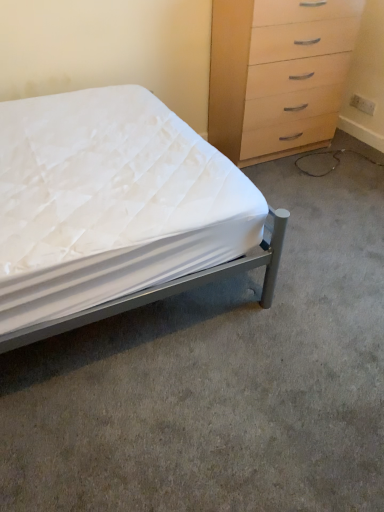
What is the approximate width of white fabric bed at lower left?

white fabric bed at lower left is 2.35 meters in width.

I want to click on metallic gray bed at left, so click(x=116, y=211).

Identify the location of light wood/wooden chest of drawers at upper right. (278, 74).

Which object is closer to the camera taking this photo, metallic gray bed at left or light wood/wooden chest of drawers at upper right?

Positioned in front is metallic gray bed at left.

Are metallic gray bed at left and light wood/wooden chest of drawers at upper right beside each other?

No, metallic gray bed at left is not beside light wood/wooden chest of drawers at upper right.

Is metallic gray bed at left positioned with its back to light wood/wooden chest of drawers at upper right?

metallic gray bed at left is not turned away from light wood/wooden chest of drawers at upper right.

Considering the sizes of objects light wood/wooden chest of drawers at upper right and white fabric bed at lower left in the image provided, who is bigger, light wood/wooden chest of drawers at upper right or white fabric bed at lower left?

light wood/wooden chest of drawers at upper right is bigger.

From the picture: From a real-world perspective, is light wood/wooden chest of drawers at upper right positioned under white fabric bed at lower left based on gravity?

Incorrect, from a real-world perspective, light wood/wooden chest of drawers at upper right is higher than white fabric bed at lower left.

Considering the sizes of light wood/wooden chest of drawers at upper right and white fabric bed at lower left in the image, is light wood/wooden chest of drawers at upper right wider or thinner than white fabric bed at lower left?

Considering their sizes, light wood/wooden chest of drawers at upper right looks slimmer than white fabric bed at lower left.

From the image's perspective, is light wood/wooden chest of drawers at upper right under white fabric bed at lower left?

No, from the image's perspective, light wood/wooden chest of drawers at upper right is not below white fabric bed at lower left.

Is light wood/wooden chest of drawers at upper right positioned far away from metallic gray bed at left?

Absolutely, light wood/wooden chest of drawers at upper right is distant from metallic gray bed at left.

Consider the image. Between light wood/wooden chest of drawers at upper right and metallic gray bed at left, which one has larger size?

metallic gray bed at left.

You are a GUI agent. You are given a task and a screenshot of the screen. Output one action in this format:
    pyautogui.click(x=<x>, y=<y>)
    Task: Click on the bed below the light wood/wooden chest of drawers at upper right (from a real-world perspective)
    The image size is (384, 512).
    Given the screenshot: What is the action you would take?
    (x=116, y=211)

Is white fabric bed at lower left thinner than metallic gray bed at left?

Incorrect, the width of white fabric bed at lower left is not less than that of metallic gray bed at left.

Is metallic gray bed at left a part of white fabric bed at lower left?

Definitely not — metallic gray bed at left is not inside white fabric bed at lower left.

From a real-world perspective, which is physically below, white fabric bed at lower left or metallic gray bed at left?

white fabric bed at lower left is physically lower.

Considering the positions of objects white fabric bed at lower left and metallic gray bed at left in the image provided, who is more to the left, white fabric bed at lower left or metallic gray bed at left?

Positioned to the left is metallic gray bed at left.

Does white fabric bed at lower left have a larger size compared to light wood/wooden chest of drawers at upper right?

Incorrect, white fabric bed at lower left is not larger than light wood/wooden chest of drawers at upper right.

From a real-world perspective, is white fabric bed at lower left physically located above or below light wood/wooden chest of drawers at upper right?

Clearly, from a real-world perspective, white fabric bed at lower left is below light wood/wooden chest of drawers at upper right.

From the image's perspective, is white fabric bed at lower left above light wood/wooden chest of drawers at upper right?

No.

Does point (325, 310) come farther from viewer compared to point (247, 38)?

That is False.

Who is bigger, metallic gray bed at left or white fabric bed at lower left?

Bigger between the two is metallic gray bed at left.

Which of these two, metallic gray bed at left or white fabric bed at lower left, stands shorter?

white fabric bed at lower left.

Which is less distant, (11, 336) or (86, 434)?

The point (11, 336) is closer.

Could you tell me if metallic gray bed at left is turned towards white fabric bed at lower left?

Yes.

In the image, there is a light wood/wooden chest of drawers at upper right. Identify the location of bed below it (from a real-world perspective). (116, 211).

Locate an element on the screen. the chest of drawers that appears above the white fabric bed at lower left (from a real-world perspective) is located at coordinates [278, 74].

Based on their spatial positions, is light wood/wooden chest of drawers at upper right or metallic gray bed at left further from white fabric bed at lower left?

Based on the image, light wood/wooden chest of drawers at upper right appears to be further to white fabric bed at lower left.

Looking at the image, which one is located further to metallic gray bed at left, white fabric bed at lower left or light wood/wooden chest of drawers at upper right?

light wood/wooden chest of drawers at upper right lies further to metallic gray bed at left than the other object.

In the scene shown: Which object lies nearer to the anchor point light wood/wooden chest of drawers at upper right, white fabric bed at lower left or metallic gray bed at left?

metallic gray bed at left is positioned closer to the anchor light wood/wooden chest of drawers at upper right.

From the image, which object appears to be farther from metallic gray bed at left, light wood/wooden chest of drawers at upper right or white fabric bed at lower left?

light wood/wooden chest of drawers at upper right is positioned further to the anchor metallic gray bed at left.

Based on their spatial positions, is metallic gray bed at left or light wood/wooden chest of drawers at upper right closer to white fabric bed at lower left?

The object closer to white fabric bed at lower left is metallic gray bed at left.

When comparing their distances from light wood/wooden chest of drawers at upper right, does metallic gray bed at left or white fabric bed at lower left seem further?

white fabric bed at lower left is further to light wood/wooden chest of drawers at upper right.

You are a GUI agent. You are given a task and a screenshot of the screen. Output one action in this format:
    pyautogui.click(x=<x>, y=<y>)
    Task: Click on the concrete between metallic gray bed at left and light wood/wooden chest of drawers at upper right in the front-back direction
    
    Given the screenshot: What is the action you would take?
    pyautogui.click(x=221, y=379)